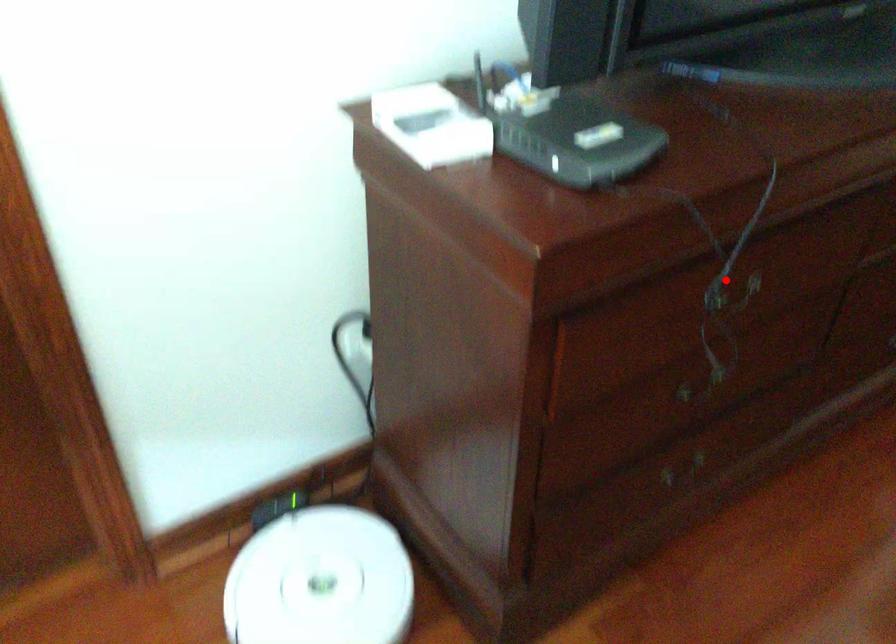
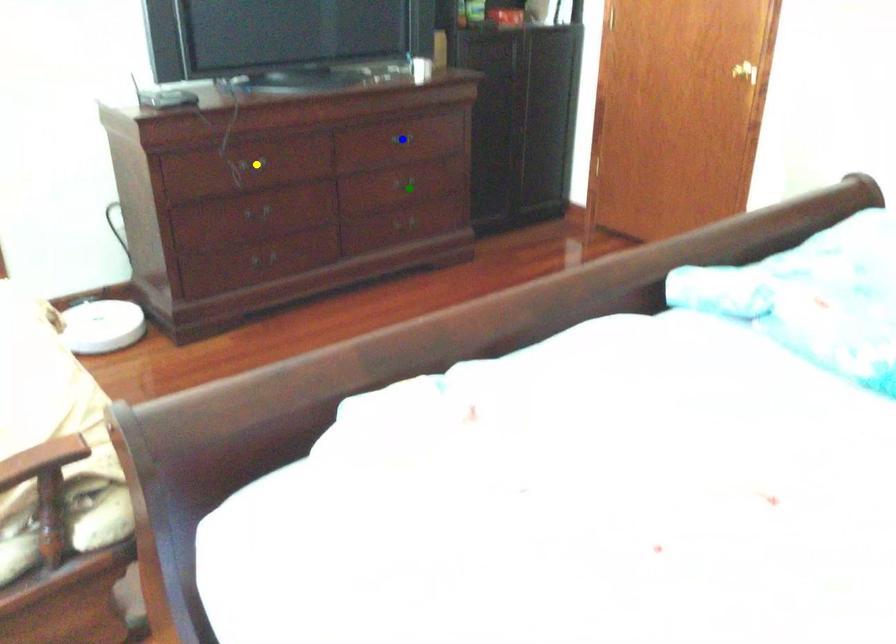
Question: I am providing you with two images of the same scene from different viewpoints. A red point is marked on the first image. You are given multiple points on the second image. Which spot in image 2 lines up with the point in image 1?

Choices:
 (A) green point
 (B) yellow point
 (C) blue point

Answer: (B)